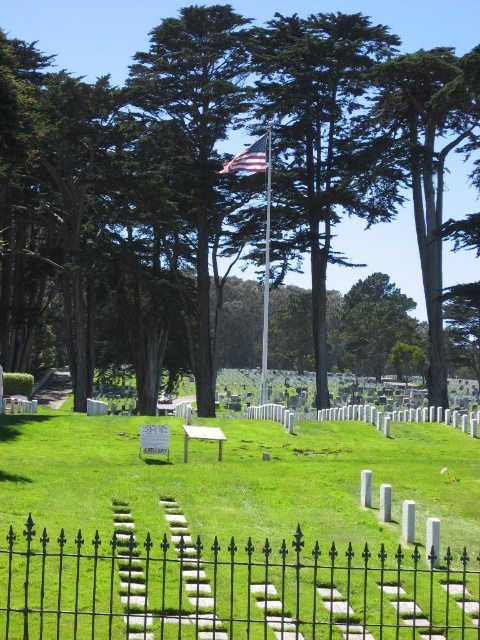
In the scene shown: Is the position of black wrought iron fence at lower center less distant than that of american flag at center?

Yes, black wrought iron fence at lower center is in front of american flag at center.

Find the location of `black wrought iron fence at lower center`. black wrought iron fence at lower center is located at coordinates (229, 589).

Image resolution: width=480 pixels, height=640 pixels. In order to click on black wrought iron fence at lower center in this screenshot , I will do `click(229, 589)`.

Identify the location of green textured tree at center. This screenshot has width=480, height=640. (320, 141).

Identify the location of green textured tree at center. (320, 141).

Is the position of black wrought iron fence at lower center less distant than that of silver metallic flag pole at center?

That is True.

Who is lower down, black wrought iron fence at lower center or silver metallic flag pole at center?

black wrought iron fence at lower center is below.

Is point (372, 564) behind point (261, 400)?

No.

Locate an element on the screen. black wrought iron fence at lower center is located at coordinates click(x=229, y=589).